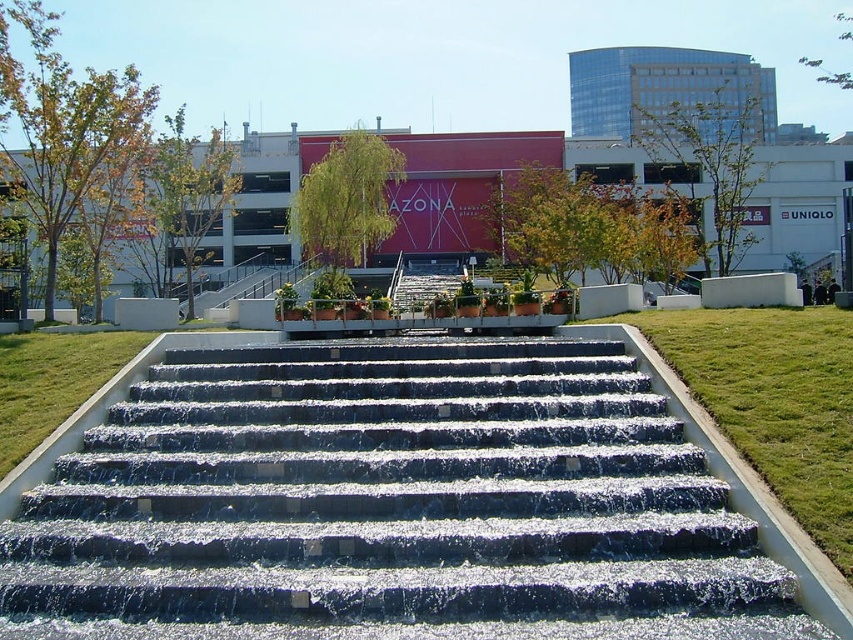
Between smooth stone steps at center and green grass at lower right, which one is positioned higher?

Positioned higher is green grass at lower right.

Is point (393, 525) farther from viewer compared to point (762, 465)?

No, it is not.

Is point (751, 524) more distant than point (834, 433)?

No, it is not.

Image resolution: width=853 pixels, height=640 pixels. Find the location of `smooth stone steps at center`. smooth stone steps at center is located at coordinates (392, 506).

Does smooth stone steps at center have a greater width compared to metallic silver balustrade at center?

Correct, the width of smooth stone steps at center exceeds that of metallic silver balustrade at center.

Does smooth stone steps at center have a smaller size compared to metallic silver balustrade at center?

Indeed, smooth stone steps at center has a smaller size compared to metallic silver balustrade at center.

Is point (245, 499) closer to camera compared to point (328, 321)?

Yes, point (245, 499) is in front of point (328, 321).

Locate an element on the screen. This screenshot has height=640, width=853. smooth stone steps at center is located at coordinates (392, 506).

Does green grass at lower right have a lesser width compared to metallic silver balustrade at center?

Correct, green grass at lower right's width is less than metallic silver balustrade at center's.

Between green grass at lower right and metallic silver balustrade at center, which one has less height?

Standing shorter between the two is green grass at lower right.

Is point (751, 340) closer to camera compared to point (383, 332)?

Yes, point (751, 340) is in front of point (383, 332).

Image resolution: width=853 pixels, height=640 pixels. Identify the location of green grass at lower right. (773, 401).